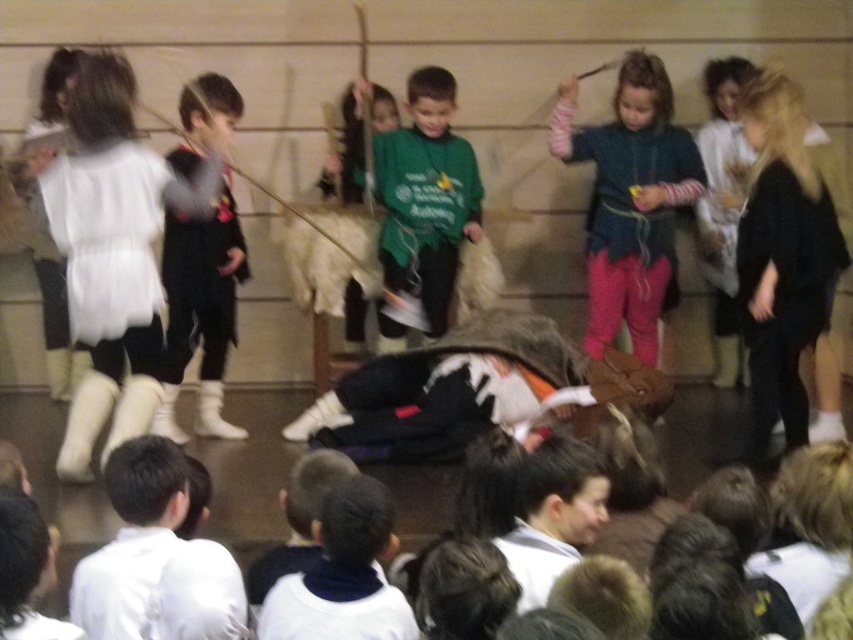
You are a photographer standing in the back of the auditorium. You want to take a photo of the black sweater at right and the matte black vest at left so that both are visible in the frame. Considering their heights, which object should you focus on to ensure both are in focus?

The black sweater at right is much taller than the matte black vest at left. To ensure both are in focus, you should focus on the black sweater at right since it is farther away, allowing the depth of field to include the closer matte black vest at left.

You are a photographer in the audience and want to take a photo of the green matte shirt at center and the matte black vest at left. Which one should you focus on first if you want to capture both in the same frame?

The green matte shirt at center is positioned on the right side of matte black vest at left, so you should focus on the matte black vest at left first to ensure both are in the frame.